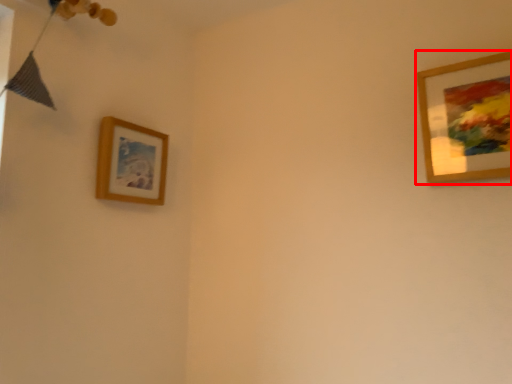
Question: Observing the image, what is the correct spatial positioning of picture frame (annotated by the red box) in reference to picture frame?

Choices:
 (A) left
 (B) right

Answer: (B)